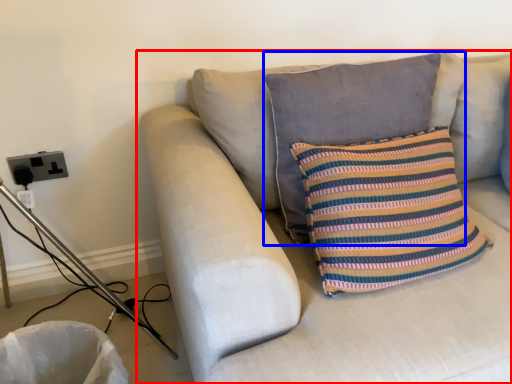
Question: Among these objects, which one is nearest to the camera, studio couch (highlighted by a red box) or pillow (highlighted by a blue box)?

Choices:
 (A) studio couch
 (B) pillow

Answer: (A)